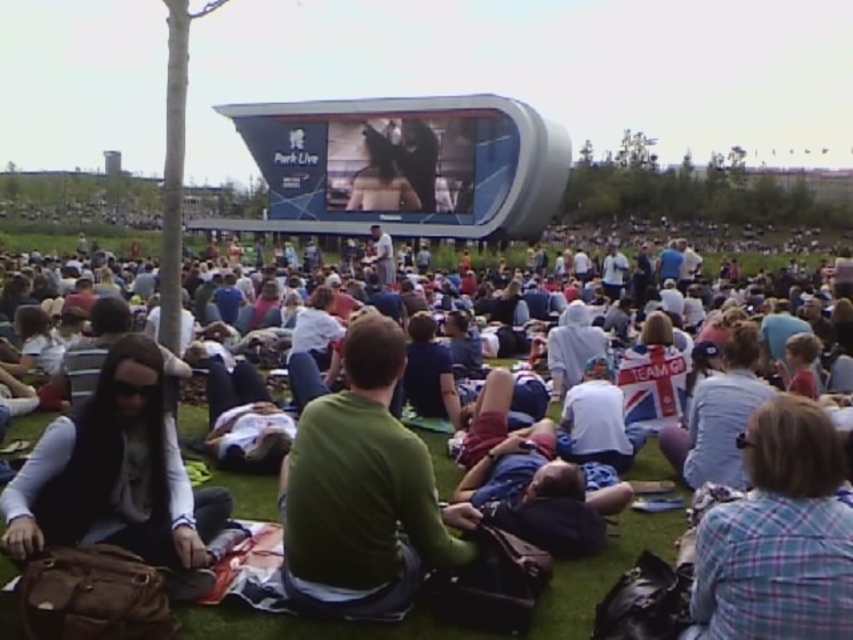
Question: Can you confirm if green cotton shirt at center is positioned to the left of brown leather backpack at lower left?

Choices:
 (A) no
 (B) yes

Answer: (A)

Question: Among these points, which one is nearest to the camera?

Choices:
 (A) (704, 620)
 (B) (212, 472)
 (C) (120, 460)
 (D) (347, 486)

Answer: (A)

Question: Which of the following is the closest to the observer?

Choices:
 (A) (392, 602)
 (B) (820, 458)

Answer: (B)

Question: Among these objects, which one is farthest from the camera?

Choices:
 (A) green cotton shirt at center
 (B) brown leather backpack at lower left
 (C) green matte shirt at center

Answer: (C)

Question: Is plaid fabric shirt at lower right closer to the viewer compared to brown leather backpack at lower left?

Choices:
 (A) no
 (B) yes

Answer: (B)

Question: Can you confirm if green cotton shirt at center is wider than plaid fabric shirt at lower right?

Choices:
 (A) yes
 (B) no

Answer: (A)